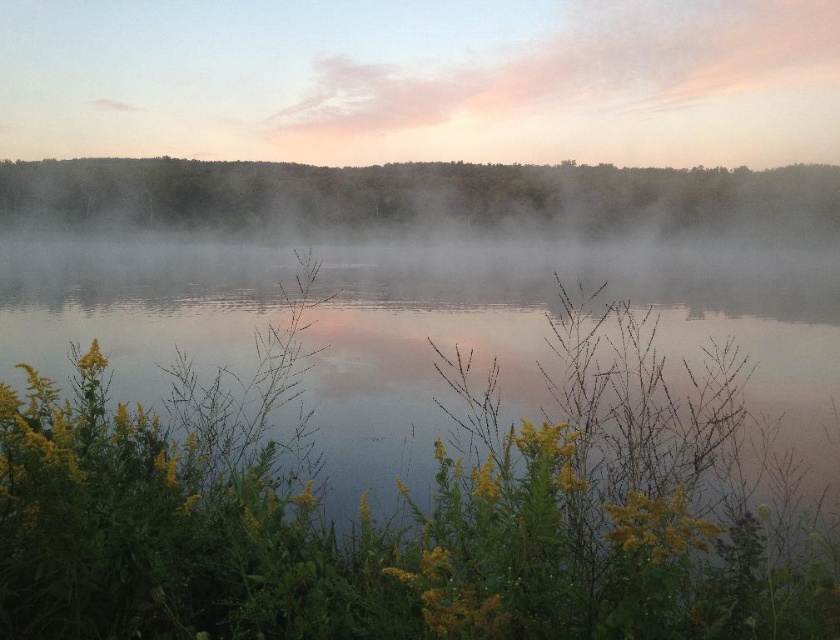
Who is more forward, (688,314) or (765,216)?

Point (688,314) is more forward.

Does point (489, 292) lie behind point (269, 205)?

No, it is not.

This screenshot has width=840, height=640. I want to click on transparent misty water at center, so click(557, 342).

Identify the location of transparent misty water at center. (557, 342).